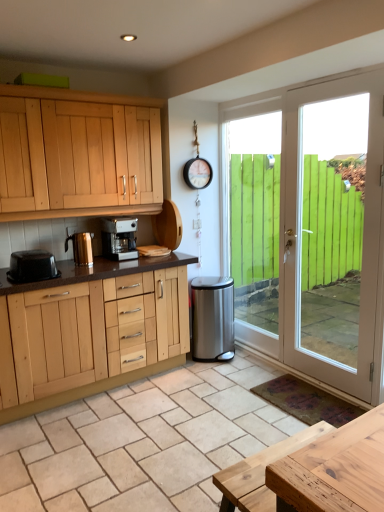
Question: Considering the relative sizes of satin silver coffee maker at center, which is the 3th kitchen appliance from left to right, and black plastic toaster at left, the 1th kitchen appliance positioned from the left, in the image provided, is satin silver coffee maker at center, which is the 3th kitchen appliance from left to right, shorter than black plastic toaster at left, the 1th kitchen appliance positioned from the left,?

Choices:
 (A) no
 (B) yes

Answer: (A)

Question: Are satin silver coffee maker at center, the first kitchen appliance viewed from the right, and black plastic toaster at left, which is the 3th kitchen appliance from right to left, far apart?

Choices:
 (A) no
 (B) yes

Answer: (A)

Question: Considering the relative positions of satin silver coffee maker at center, the first kitchen appliance viewed from the right, and black plastic toaster at left, the 1th kitchen appliance positioned from the left, in the image provided, is satin silver coffee maker at center, the first kitchen appliance viewed from the right, in front of black plastic toaster at left, the 1th kitchen appliance positioned from the left,?

Choices:
 (A) no
 (B) yes

Answer: (A)

Question: Is black plastic toaster at left, the 1th kitchen appliance positioned from the left, inside satin silver coffee maker at center, which is the 3th kitchen appliance from left to right?

Choices:
 (A) no
 (B) yes

Answer: (A)

Question: Can you confirm if satin silver coffee maker at center, which is the 3th kitchen appliance from left to right, is wider than black plastic toaster at left, the 1th kitchen appliance positioned from the left?

Choices:
 (A) yes
 (B) no

Answer: (B)

Question: Is satin silver coffee maker at center, which is the 3th kitchen appliance from left to right, at the left side of black plastic toaster at left, which is the 3th kitchen appliance from right to left?

Choices:
 (A) yes
 (B) no

Answer: (B)

Question: Can you confirm if black plastic toaster at left, which is the 3th kitchen appliance from right to left, is positioned to the right of satin silver coffee maker at center, which is the 3th kitchen appliance from left to right?

Choices:
 (A) no
 (B) yes

Answer: (A)

Question: From a real-world perspective, is black plastic toaster at left, which is the 3th kitchen appliance from right to left, located beneath satin silver coffee maker at center, the first kitchen appliance viewed from the right?

Choices:
 (A) yes
 (B) no

Answer: (A)

Question: Is black plastic toaster at left, which is the 3th kitchen appliance from right to left, smaller than satin silver coffee maker at center, which is the 3th kitchen appliance from left to right?

Choices:
 (A) yes
 (B) no

Answer: (A)

Question: Does black plastic toaster at left, which is the 3th kitchen appliance from right to left, lie behind satin silver coffee maker at center, which is the 3th kitchen appliance from left to right?

Choices:
 (A) no
 (B) yes

Answer: (A)

Question: Does black plastic toaster at left, the 1th kitchen appliance positioned from the left, touch satin silver coffee maker at center, the first kitchen appliance viewed from the right?

Choices:
 (A) no
 (B) yes

Answer: (A)

Question: Is black plastic toaster at left, which is the 3th kitchen appliance from right to left, wider than satin silver coffee maker at center, which is the 3th kitchen appliance from left to right?

Choices:
 (A) yes
 (B) no

Answer: (A)

Question: Is stainless steel trash can at lower right to the left of white glossy door at right from the viewer's perspective?

Choices:
 (A) yes
 (B) no

Answer: (A)